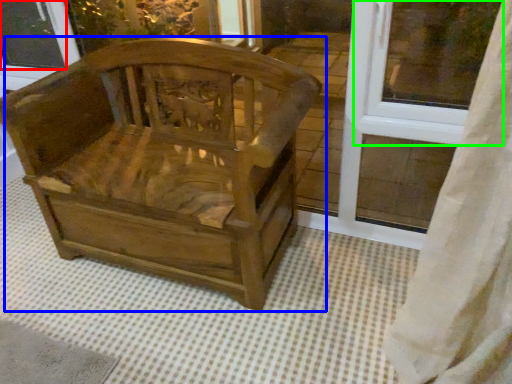
Question: Which is nearer to the window screen (highlighted by a red box)? chair (highlighted by a blue box) or window frame (highlighted by a green box).

Choices:
 (A) chair
 (B) window frame

Answer: (A)